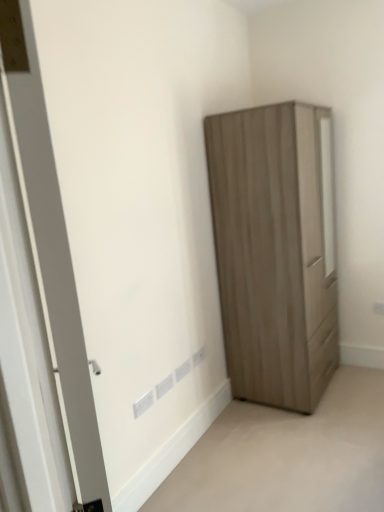
Question: Could you tell me if matte wood wardrobe at right is turned towards matte wood wardrobe at lower right?

Choices:
 (A) yes
 (B) no

Answer: (B)

Question: Is matte wood wardrobe at right positioned in front of matte wood wardrobe at lower right?

Choices:
 (A) no
 (B) yes

Answer: (A)

Question: Considering the relative positions of matte wood wardrobe at right and matte wood wardrobe at lower right in the image provided, is matte wood wardrobe at right to the left of matte wood wardrobe at lower right from the viewer's perspective?

Choices:
 (A) no
 (B) yes

Answer: (B)

Question: Considering the relative sizes of matte wood wardrobe at right and matte wood wardrobe at lower right in the image provided, is matte wood wardrobe at right wider than matte wood wardrobe at lower right?

Choices:
 (A) yes
 (B) no

Answer: (B)

Question: From the image's perspective, is matte wood wardrobe at right beneath matte wood wardrobe at lower right?

Choices:
 (A) yes
 (B) no

Answer: (B)

Question: Is the depth of matte wood wardrobe at right greater than that of matte wood wardrobe at lower right?

Choices:
 (A) no
 (B) yes

Answer: (B)

Question: Does matte wood wardrobe at right appear on the left side of white plastic electric outlet at lower center?

Choices:
 (A) yes
 (B) no

Answer: (B)

Question: Considering the relative positions of matte wood wardrobe at right and white plastic electric outlet at lower center in the image provided, is matte wood wardrobe at right to the right of white plastic electric outlet at lower center from the viewer's perspective?

Choices:
 (A) no
 (B) yes

Answer: (B)

Question: Can you confirm if matte wood wardrobe at right is thinner than white plastic electric outlet at lower center?

Choices:
 (A) no
 (B) yes

Answer: (A)

Question: Is matte wood wardrobe at right bigger than white plastic electric outlet at lower center?

Choices:
 (A) yes
 (B) no

Answer: (A)

Question: Are matte wood wardrobe at right and white plastic electric outlet at lower center located far from each other?

Choices:
 (A) no
 (B) yes

Answer: (B)

Question: From a real-world perspective, is matte wood wardrobe at right located higher than white plastic electric outlet at lower center?

Choices:
 (A) yes
 (B) no

Answer: (A)

Question: Considering the relative sizes of white plastic electric outlet at lower center and white matte door at left in the image provided, is white plastic electric outlet at lower center smaller than white matte door at left?

Choices:
 (A) yes
 (B) no

Answer: (A)